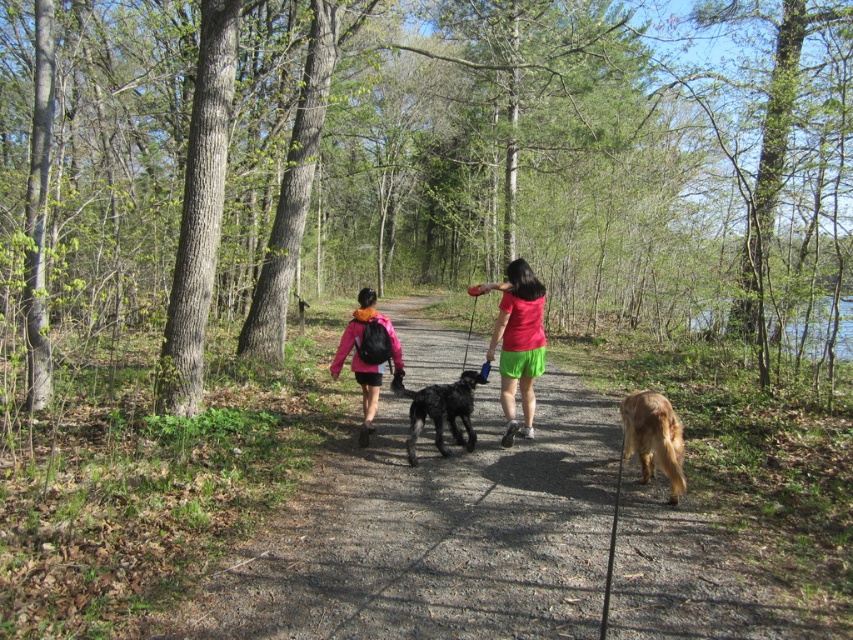
Is pink fabric jacket at center above shiny black dog at center?

Correct, pink fabric jacket at center is located above shiny black dog at center.

In the scene shown: Who is positioned more to the left, pink fabric jacket at center or shiny black dog at center?

From the viewer's perspective, pink fabric jacket at center appears more on the left side.

Identify the location of pink fabric jacket at center. (367, 355).

Who is higher up, brown dirt path at center or shiny black dog at center?

Positioned higher is shiny black dog at center.

Does point (544, 541) come farther from viewer compared to point (473, 388)?

No, (544, 541) is in front of (473, 388).

Identify the location of brown dirt path at center. (433, 532).

Between matte pink shirt at center and shiny black dog at center, which one is positioned lower?

Positioned lower is shiny black dog at center.

Can you confirm if matte pink shirt at center is positioned to the left of shiny black dog at center?

In fact, matte pink shirt at center is to the right of shiny black dog at center.

At what (x,y) coordinates should I click in order to perform the action: click on matte pink shirt at center. Please return your answer as a coordinate pair (x, y). Looking at the image, I should click on (519, 344).